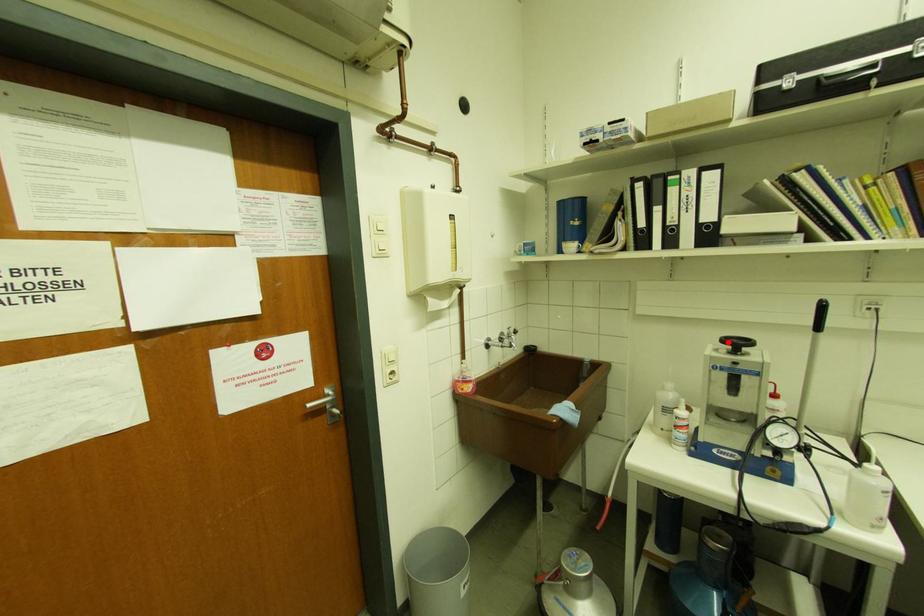
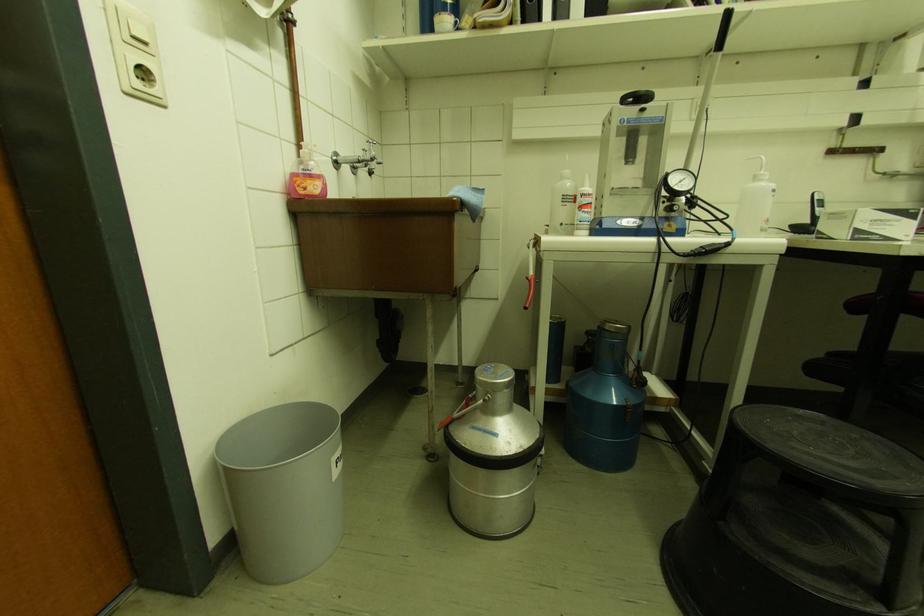
Find the pixel in the second image that matches the highlighted location in the first image.

(628, 100)